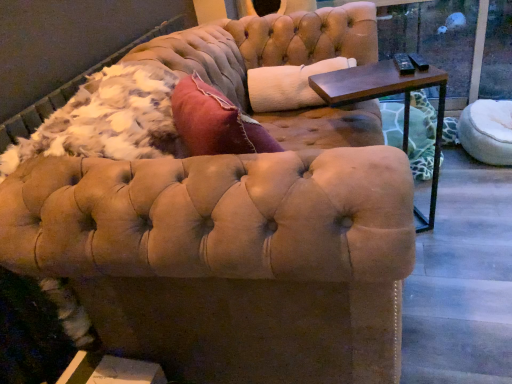
Identify the location of dark brown wood side table at upper right. The height and width of the screenshot is (384, 512). (389, 95).

Is transparent glass window screen at upper right far away from white fluffy pet bed at right?

No.

From a real-world perspective, between transparent glass window screen at upper right and white fluffy pet bed at right, who is vertically lower?

From a 3D spatial view, white fluffy pet bed at right is below.

Between transparent glass window screen at upper right and white fluffy pet bed at right, which one has larger size?

Bigger between the two is white fluffy pet bed at right.

Could white fluffy pet bed at right be considered to be inside transparent glass window screen at upper right?

No.

Looking at the image, does white fluffy pet bed at right seem bigger or smaller compared to transparent glass window screen at upper right?

Clearly, white fluffy pet bed at right is larger in size than transparent glass window screen at upper right.

Is white fluffy pet bed at right looking in the opposite direction of transparent glass window screen at upper right?

Absolutely, white fluffy pet bed at right is directed away from transparent glass window screen at upper right.

From a real-world perspective, relative to transparent glass window screen at upper right, is white fluffy pet bed at right vertically above or below?

white fluffy pet bed at right is below transparent glass window screen at upper right.

Does point (479, 124) lie behind point (446, 26)?

No.

Is point (508, 135) positioned after point (343, 84)?

Yes, point (508, 135) is farther from viewer.

Do you think white fluffy pet bed at right is within dark brown wood side table at upper right, or outside of it?

white fluffy pet bed at right is spatially situated outside dark brown wood side table at upper right.

Is white fluffy pet bed at right turned away from dark brown wood side table at upper right?

No, white fluffy pet bed at right is not facing the opposite direction of dark brown wood side table at upper right.

Based on the photo, does white fluffy pet bed at right have a larger size compared to dark brown wood side table at upper right?

No, white fluffy pet bed at right is not bigger than dark brown wood side table at upper right.

From a real-world perspective, is dark brown wood side table at upper right located higher than white fluffy pet bed at right?

Yes, from a real-world perspective, dark brown wood side table at upper right is over white fluffy pet bed at right

Is dark brown wood side table at upper right situated inside white fluffy pet bed at right or outside?

The correct answer is: outside.

Is point (403, 54) farther from viewer compared to point (511, 114)?

That is False.

Can you confirm if dark brown wood side table at upper right is positioned to the right of white fluffy pet bed at right?

No.

Which is behind, point (322, 77) or point (493, 45)?

The point (493, 45) is farther from the camera.

Considering the sizes of dark brown wood side table at upper right and transparent glass window screen at upper right in the image, is dark brown wood side table at upper right bigger or smaller than transparent glass window screen at upper right?

Clearly, dark brown wood side table at upper right is larger in size than transparent glass window screen at upper right.

Which is more to the left, dark brown wood side table at upper right or transparent glass window screen at upper right?

From the viewer's perspective, dark brown wood side table at upper right appears more on the left side.

From a real-world perspective, relative to dark brown wood side table at upper right, is transparent glass window screen at upper right vertically above or below?

transparent glass window screen at upper right is above dark brown wood side table at upper right.

Is transparent glass window screen at upper right bigger or smaller than dark brown wood side table at upper right?

Clearly, transparent glass window screen at upper right is smaller in size than dark brown wood side table at upper right.

Is transparent glass window screen at upper right in front of or behind dark brown wood side table at upper right in the image?

In the image, transparent glass window screen at upper right appears behind dark brown wood side table at upper right.

This screenshot has height=384, width=512. In order to click on swivel chair located on the right of transparent glass window screen at upper right in this screenshot , I will do `click(487, 131)`.

Where is `swivel chair that is below the transparent glass window screen at upper right (from the image's perspective)`? The height and width of the screenshot is (384, 512). swivel chair that is below the transparent glass window screen at upper right (from the image's perspective) is located at coordinates (487, 131).

When comparing their distances from transparent glass window screen at upper right, does dark brown wood side table at upper right or white fluffy pet bed at right seem further?

Based on the image, dark brown wood side table at upper right appears to be further to transparent glass window screen at upper right.

When comparing their distances from transparent glass window screen at upper right, does white fluffy pet bed at right or dark brown wood side table at upper right seem further?

dark brown wood side table at upper right is further to transparent glass window screen at upper right.

When comparing their distances from dark brown wood side table at upper right, does white fluffy pet bed at right or transparent glass window screen at upper right seem closer?

white fluffy pet bed at right is closer to dark brown wood side table at upper right.

From the image, which object appears to be nearer to white fluffy pet bed at right, dark brown wood side table at upper right or transparent glass window screen at upper right?

transparent glass window screen at upper right lies closer to white fluffy pet bed at right than the other object.

Which object lies nearer to the anchor point white fluffy pet bed at right, transparent glass window screen at upper right or dark brown wood side table at upper right?

transparent glass window screen at upper right.

Looking at the image, which one is located further to dark brown wood side table at upper right, transparent glass window screen at upper right or white fluffy pet bed at right?

Based on the image, transparent glass window screen at upper right appears to be further to dark brown wood side table at upper right.

The image size is (512, 384). I want to click on window screen situated between dark brown wood side table at upper right and white fluffy pet bed at right from left to right, so click(x=434, y=36).